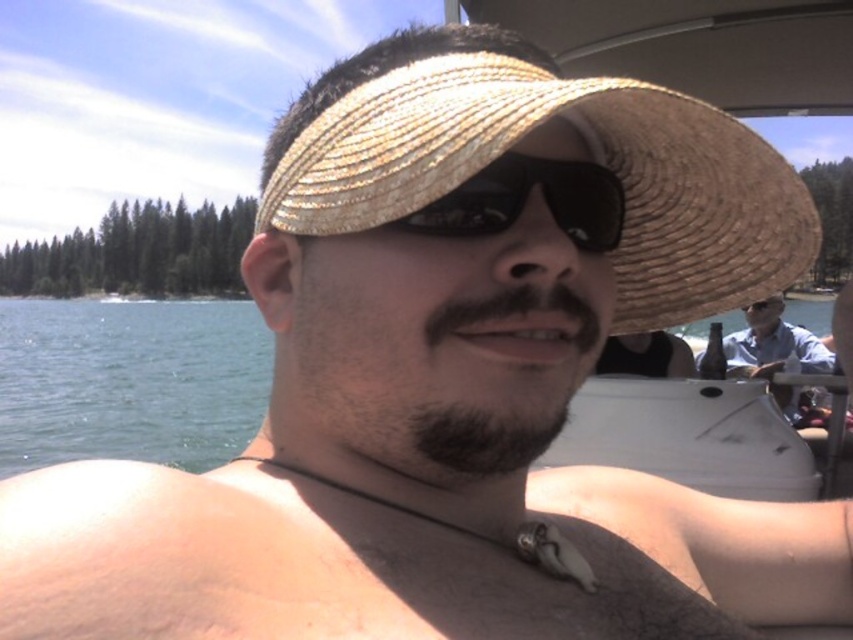
In the scene shown: You are a photographer trying to capture the reflection of the black reflective sunglasses at center and the light blue shirt at right in the water. Which object would appear narrower in the reflection?

The black reflective sunglasses at center would appear narrower in the reflection since it is thinner than the light blue shirt at right.

You are a photographer trying to capture a balanced composition. Given the green water at lower left and the light blue shirt at right, which object should you focus on to ensure the wider element is highlighted?

The green water at lower left should be focused on because its width is larger than the light blue shirt at right, making it the wider element to highlight for a balanced composition.

You are a photographer trying to capture the reflection of the light blue shirt at right in the water. Since the black reflective sunglasses at center might block the view, where should you position yourself relative to the person to ensure the reflection is visible?

The black reflective sunglasses at center is positioned over light blue shirt at right, so to capture the reflection of the light blue shirt at right in the water, you should position yourself to the side or below the person where the sunglasses do not obstruct the view of the shirt.